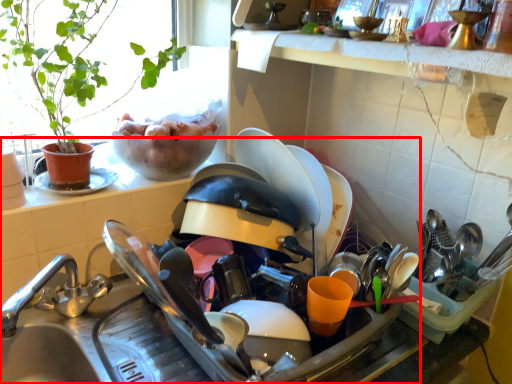
Question: Where is sink (annotated by the red box) located in relation to window sill in the image?

Choices:
 (A) left
 (B) right

Answer: (A)